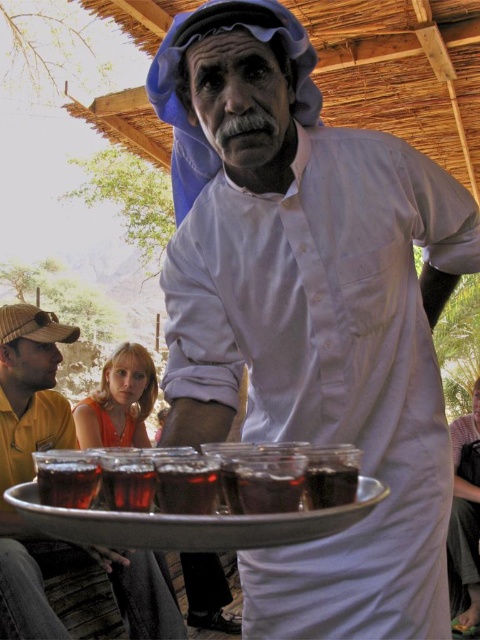
You are standing under the rustic wooden and thatched roof structure and see the point marked at coordinates (132, 582). If you want to place a small tray there, will you be able to reach it comfortably without moving closer?

The point at coordinates (132, 582) is 9.34 feet away from the viewer. Since this distance is within a comfortable reaching range for most people, you should be able to place the small tray there without needing to move closer.

You are a guest at this event and want to pick up your drink. The server is holding a tray with drinks. Which object should you reach for first, the white matte shirt at center or the translucent glass cup at lower left?

You should reach for the translucent glass cup at lower left first because it is behind the white matte shirt at center, making it closer to you.